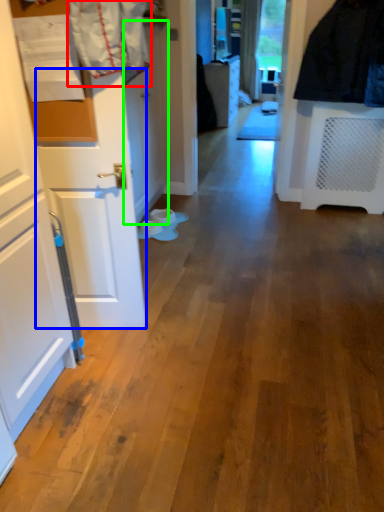
Question: Which is farther away from laundry (highlighted by a red box)? door (highlighted by a blue box) or door (highlighted by a green box)?

Choices:
 (A) door
 (B) door

Answer: (B)